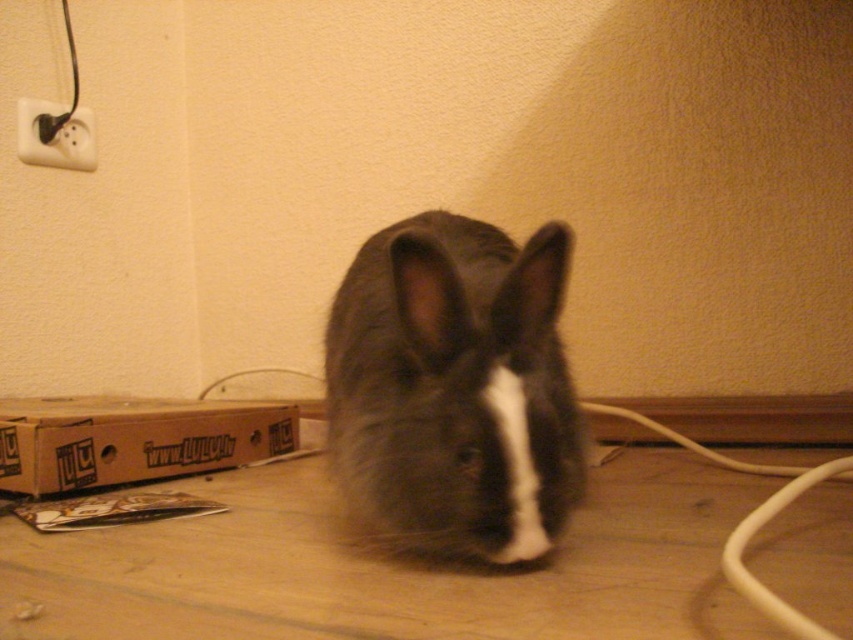
Question: From the image, what is the correct spatial relationship of fuzzy gray rabbit at center in relation to brown cardboard box at lower left?

Choices:
 (A) left
 (B) right

Answer: (B)

Question: Is fuzzy gray rabbit at center positioned before white plastic electric outlet at upper left?

Choices:
 (A) no
 (B) yes

Answer: (B)

Question: Which point is farther to the camera?

Choices:
 (A) (85, 115)
 (B) (503, 516)

Answer: (A)

Question: Is fuzzy gray rabbit at center above white plastic electric outlet at upper left?

Choices:
 (A) no
 (B) yes

Answer: (A)

Question: Considering the real-world distances, which object is closest to the fuzzy gray rabbit at center?

Choices:
 (A) brown cardboard box at lower left
 (B) white plastic electric outlet at upper left

Answer: (A)

Question: Based on their relative distances, which object is nearer to the fuzzy gray rabbit at center?

Choices:
 (A) white plastic electric outlet at upper left
 (B) brown cardboard box at lower left

Answer: (B)